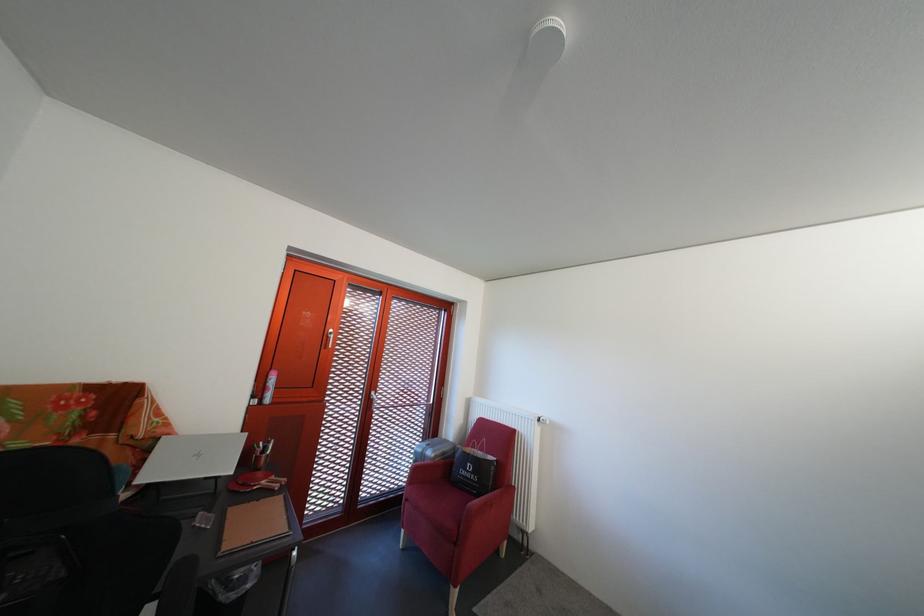
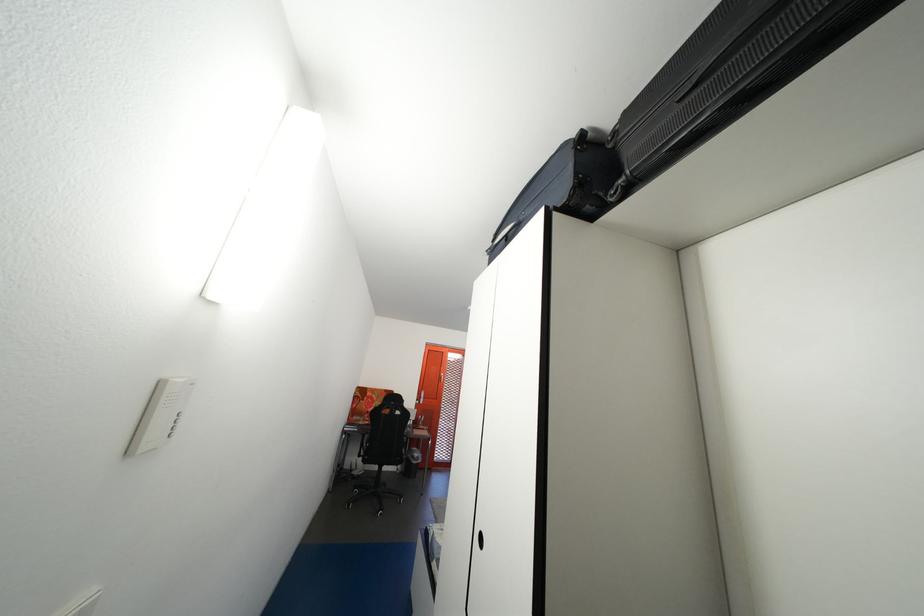
Locate, in the second image, the point that corresponds to (283,389) in the first image.

(433, 402)